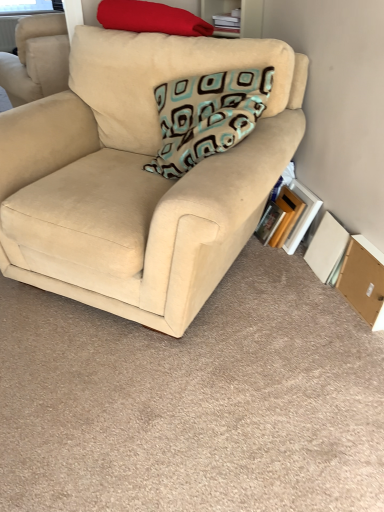
What do you see at coordinates (207, 116) in the screenshot? I see `teal-patterned fabric pillow at center, arranged as the first pillow when ordered from the bottom` at bounding box center [207, 116].

What do you see at coordinates (269, 223) in the screenshot? This screenshot has width=384, height=512. I see `hardcover book at lower right, which is the first paperback book from left to right` at bounding box center [269, 223].

Describe the element at coordinates (301, 215) in the screenshot. The image size is (384, 512). I see `hardcover book at lower right, which is the second paperback book from left to right` at that location.

What is the approximate height of brown cardboard box at lower right?

The height of brown cardboard box at lower right is 10.17 inches.

Where is `teal-patterned fabric pillow at center, arranged as the first pillow when ordered from the bottom`? teal-patterned fabric pillow at center, arranged as the first pillow when ordered from the bottom is located at coordinates (207, 116).

Is beige fabric couch at center oriented away from stacked books at upper center?

Yes, stacked books at upper center is at the back of beige fabric couch at center.

Is beige fabric couch at center taller than stacked books at upper center?

Correct, beige fabric couch at center is much taller as stacked books at upper center.

Considering the positions of point (164, 225) and point (240, 17), is point (164, 225) closer or farther from the camera than point (240, 17)?

Point (164, 225) appears to be closer to the viewer than point (240, 17).

Is beige fabric couch at center placed right next to stacked books at upper center?

They are not placed beside each other.

Which of these two, brown cardboard box at lower right or beige fabric couch at center, is wider?

beige fabric couch at center is wider.

From the image's perspective, is brown cardboard box at lower right on top of beige fabric couch at center?

No, from the image's perspective, brown cardboard box at lower right is not on top of beige fabric couch at center.

Could you tell me if brown cardboard box at lower right is turned towards beige fabric couch at center?

Yes, brown cardboard box at lower right is aimed at beige fabric couch at center.

Does hardcover book at lower right, the 2th paperback book positioned from the right, come behind brown cardboard box at lower right?

Yes, it is behind brown cardboard box at lower right.

Would you say hardcover book at lower right, which is the second paperback book from left to right, contains brown cardboard box at lower right?

No, brown cardboard box at lower right is not a part of hardcover book at lower right, which is the second paperback book from left to right.

Is point (298, 196) farther from camera compared to point (377, 263)?

Yes, point (298, 196) is behind point (377, 263).

From the image's perspective, is hardcover book at lower right, which is the second paperback book from left to right, under brown cardboard box at lower right?

No.

From the image's perspective, is white cardboard book at lower right, the third paperback book in the left-to-right sequence, located beneath teal-patterned fabric pillow at center, arranged as the first pillow when ordered from the bottom?

Yes, from the image's perspective, white cardboard book at lower right, the third paperback book in the left-to-right sequence, is below teal-patterned fabric pillow at center, arranged as the first pillow when ordered from the bottom.

I want to click on the 1st paperback book behind when counting from the teal-patterned fabric pillow at center, arranged as the first pillow when ordered from the bottom, so click(x=326, y=246).

Considering the points (315, 244) and (267, 91), which point is in front, point (315, 244) or point (267, 91)?

Positioned in front is point (267, 91).

Which object is further away from the camera, white cardboard book at lower right, the third paperback book in the left-to-right sequence, or teal-patterned fabric pillow at center, which ranks as the 2th pillow in top-to-bottom order?

white cardboard book at lower right, the third paperback book in the left-to-right sequence, is further away from the camera.

From their relative heights in the image, would you say white cardboard book at lower right, the third paperback book in the left-to-right sequence, is taller or shorter than beige fabric couch at center?

In the image, white cardboard book at lower right, the third paperback book in the left-to-right sequence, appears to be shorter than beige fabric couch at center.

Considering the sizes of objects white cardboard book at lower right, the first paperback book in the right-to-left sequence, and beige fabric couch at center in the image provided, who is smaller, white cardboard book at lower right, the first paperback book in the right-to-left sequence, or beige fabric couch at center?

white cardboard book at lower right, the first paperback book in the right-to-left sequence, is smaller.

Is white cardboard book at lower right, the first paperback book in the right-to-left sequence, closer to the viewer compared to beige fabric couch at center?

No, it is behind beige fabric couch at center.

Which object is wider, white cardboard book at lower right, the third paperback book in the left-to-right sequence, or beige fabric couch at center?

beige fabric couch at center.

Is hardcover book at lower right, the third paperback book positioned from the right, completely or partially inside brown cardboard box at lower right?

No, brown cardboard box at lower right does not contain hardcover book at lower right, the third paperback book positioned from the right.

Considering the sizes of brown cardboard box at lower right and hardcover book at lower right, which is the first paperback book from left to right, in the image, is brown cardboard box at lower right wider or thinner than hardcover book at lower right, which is the first paperback book from left to right,?

In the image, brown cardboard box at lower right appears to be more narrow than hardcover book at lower right, which is the first paperback book from left to right.

From a real-world perspective, which object rests below the other?

hardcover book at lower right, which is the first paperback book from left to right, from a real-world perspective.

Considering the positions of points (81, 247) and (314, 256), is point (81, 247) farther from camera compared to point (314, 256)?

No, (81, 247) is closer to viewer.

Are beige fabric couch at center and white cardboard book at lower right, the third paperback book in the left-to-right sequence, beside each other?

No, beige fabric couch at center is not touching white cardboard book at lower right, the third paperback book in the left-to-right sequence.

Considering the positions of objects beige fabric couch at center and white cardboard book at lower right, the third paperback book in the left-to-right sequence, in the image provided, who is more to the right, beige fabric couch at center or white cardboard book at lower right, the third paperback book in the left-to-right sequence,?

Positioned to the right is white cardboard book at lower right, the third paperback book in the left-to-right sequence.

Considering the relative sizes of beige fabric couch at center and white cardboard book at lower right, the third paperback book in the left-to-right sequence, in the image provided, is beige fabric couch at center smaller than white cardboard book at lower right, the third paperback book in the left-to-right sequence,?

Actually, beige fabric couch at center might be larger than white cardboard book at lower right, the third paperback book in the left-to-right sequence.

You are a GUI agent. You are given a task and a screenshot of the screen. Output one action in this format:
    pyautogui.click(x=<x>, y=<y>)
    Task: Click on the shelf positioned vertically above the beige fabric couch at center (from a real-world perspective)
    
    Given the screenshot: What is the action you would take?
    pyautogui.click(x=222, y=16)

Image resolution: width=384 pixels, height=512 pixels. Identify the location of studio couch on the left of the brown cardboard box at lower right. (137, 179).

Based on the photo, when comparing their distances from teal-patterned fabric pillow at center, arranged as the first pillow when ordered from the bottom, does stacked books at upper center or white cardboard book at lower right, the first paperback book in the right-to-left sequence, seem further?

Among the two, white cardboard book at lower right, the first paperback book in the right-to-left sequence, is located further to teal-patterned fabric pillow at center, arranged as the first pillow when ordered from the bottom.

Considering their positions, is hardcover book at lower right, the 2th paperback book positioned from the right, positioned further to beige fabric couch at center than stacked books at upper center?

hardcover book at lower right, the 2th paperback book positioned from the right, lies further to beige fabric couch at center than the other object.

When comparing their distances from beige fabric couch at center, does white cardboard book at lower right, the first paperback book in the right-to-left sequence, or stacked books at upper center seem closer?

Based on the image, stacked books at upper center appears to be nearer to beige fabric couch at center.

When comparing their distances from hardcover book at lower right, which is the first paperback book from left to right, does brown cardboard box at lower right or hardcover book at lower right, the 2th paperback book positioned from the right, seem further?

brown cardboard box at lower right is positioned further to the anchor hardcover book at lower right, which is the first paperback book from left to right.

Which object lies nearer to the anchor point matte red pillow at upper left, the 2th pillow when ordered from bottom to top, white cardboard book at lower right, the first paperback book in the right-to-left sequence, or brown cardboard box at lower right?

white cardboard book at lower right, the first paperback book in the right-to-left sequence, is positioned closer to the anchor matte red pillow at upper left, the 2th pillow when ordered from bottom to top.

Which object lies nearer to the anchor point hardcover book at lower right, the third paperback book positioned from the right, beige fabric couch at center or brown cardboard box at lower right?

brown cardboard box at lower right is closer to hardcover book at lower right, the third paperback book positioned from the right.

Based on their spatial positions, is hardcover book at lower right, which is the second paperback book from left to right, or teal-patterned fabric pillow at center, arranged as the first pillow when ordered from the bottom, further from hardcover book at lower right, the third paperback book positioned from the right?

Based on the image, teal-patterned fabric pillow at center, arranged as the first pillow when ordered from the bottom, appears to be further to hardcover book at lower right, the third paperback book positioned from the right.

Looking at this image, looking at the image, which one is located closer to beige fabric couch at center, hardcover book at lower right, the third paperback book positioned from the right, or white cardboard book at lower right, the first paperback book in the right-to-left sequence?

hardcover book at lower right, the third paperback book positioned from the right, is positioned closer to the anchor beige fabric couch at center.

Identify the location of studio couch between matte red pillow at upper left, the 2th pillow when ordered from bottom to top, and brown cardboard box at lower right vertically. The height and width of the screenshot is (512, 384). (137, 179).

Where is `studio couch between stacked books at upper center and brown cardboard box at lower right vertically`? studio couch between stacked books at upper center and brown cardboard box at lower right vertically is located at coordinates (137, 179).

The image size is (384, 512). I want to click on pillow between matte red pillow at upper left, the 2th pillow when ordered from bottom to top, and brown cardboard box at lower right in the up-down direction, so click(207, 116).

Find the location of a particular element. This screenshot has height=512, width=384. paperback book between matte red pillow at upper left, the 2th pillow when ordered from bottom to top, and hardcover book at lower right, which is the first paperback book from left to right, from top to bottom is located at coordinates (301, 215).